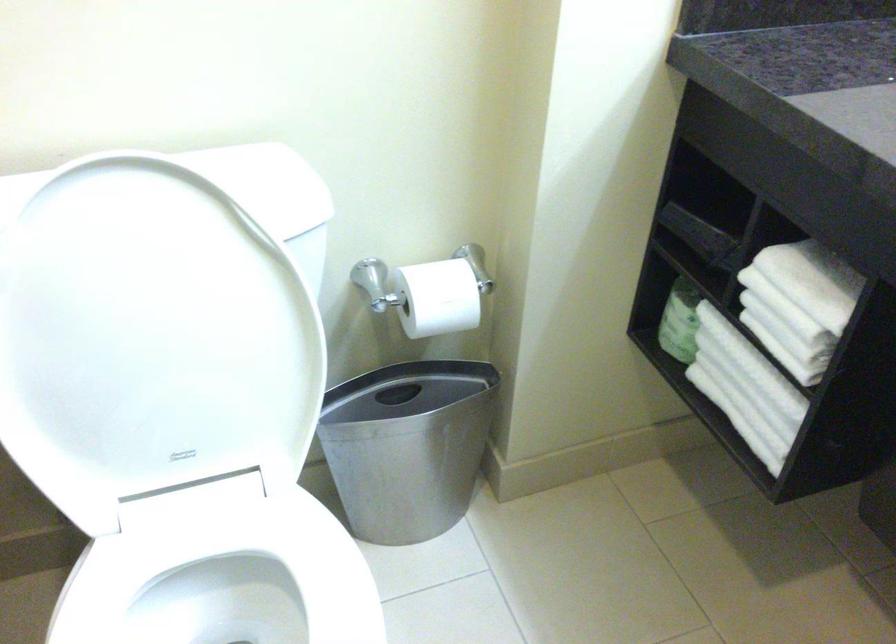
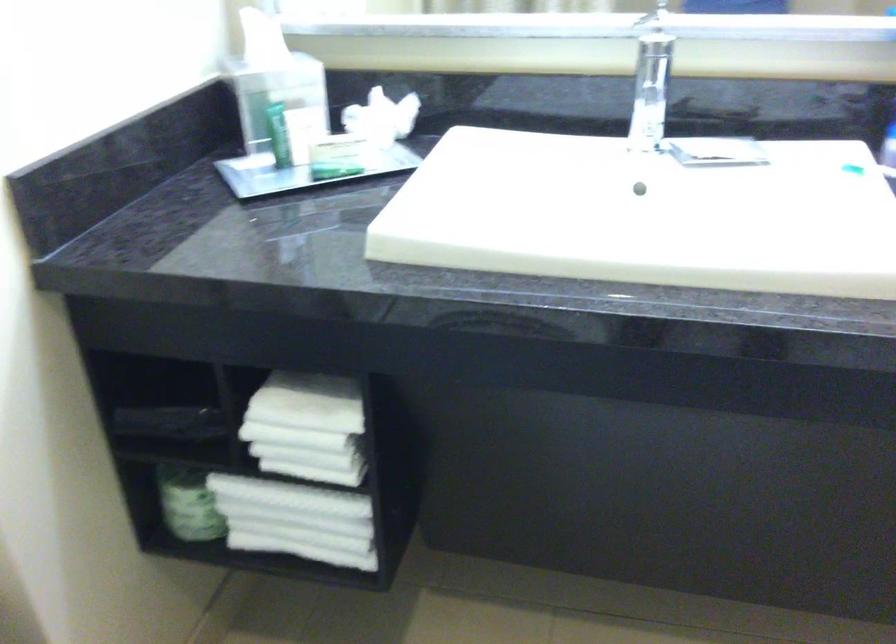
Find the pixel in the second image that matches point (744, 386) in the first image.

(296, 520)